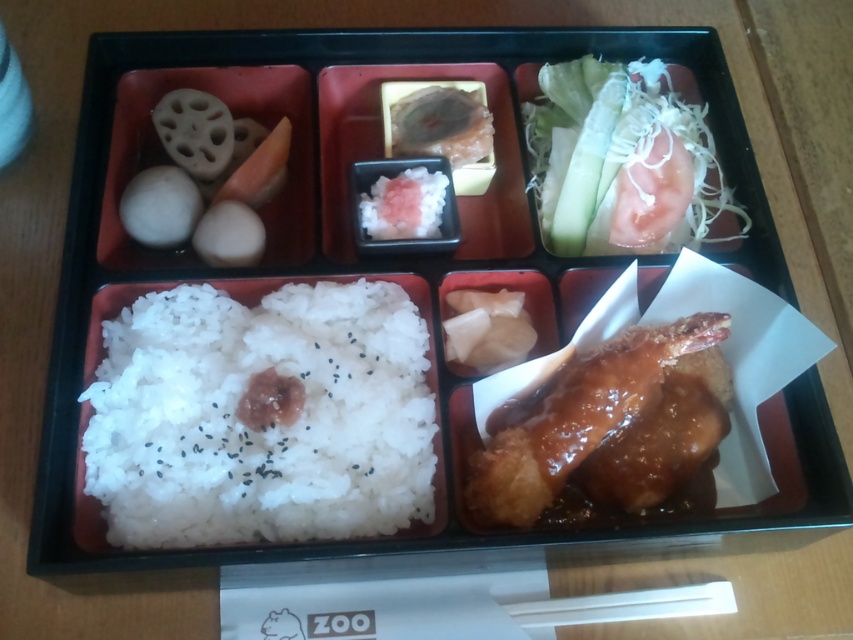
The image size is (853, 640). I want to click on slightly translucent pinkish at center, so click(440, 124).

Does point (474, 124) come behind point (436, 188)?

Yes, point (474, 124) is farther from viewer.

The height and width of the screenshot is (640, 853). Find the location of `slightly translucent pinkish at center`. slightly translucent pinkish at center is located at coordinates (440, 124).

Does white matte rice at center have a lesser width compared to slightly translucent pinkish at center?

In fact, white matte rice at center might be wider than slightly translucent pinkish at center.

Is white matte rice at center shorter than slightly translucent pinkish at center?

No, white matte rice at center is not shorter than slightly translucent pinkish at center.

Based on the photo, who is more distant from viewer, (117, 337) or (456, 106)?

Point (456, 106)

Find the location of a particular element. white matte rice at center is located at coordinates (267, 428).

Does glossy brown chicken at bottom right have a lesser height compared to white shredded vegetable at upper right?

Correct, glossy brown chicken at bottom right is not as tall as white shredded vegetable at upper right.

This screenshot has height=640, width=853. What do you see at coordinates (608, 422) in the screenshot? I see `glossy brown chicken at bottom right` at bounding box center [608, 422].

Image resolution: width=853 pixels, height=640 pixels. Find the location of `glossy brown chicken at bottom right`. glossy brown chicken at bottom right is located at coordinates (608, 422).